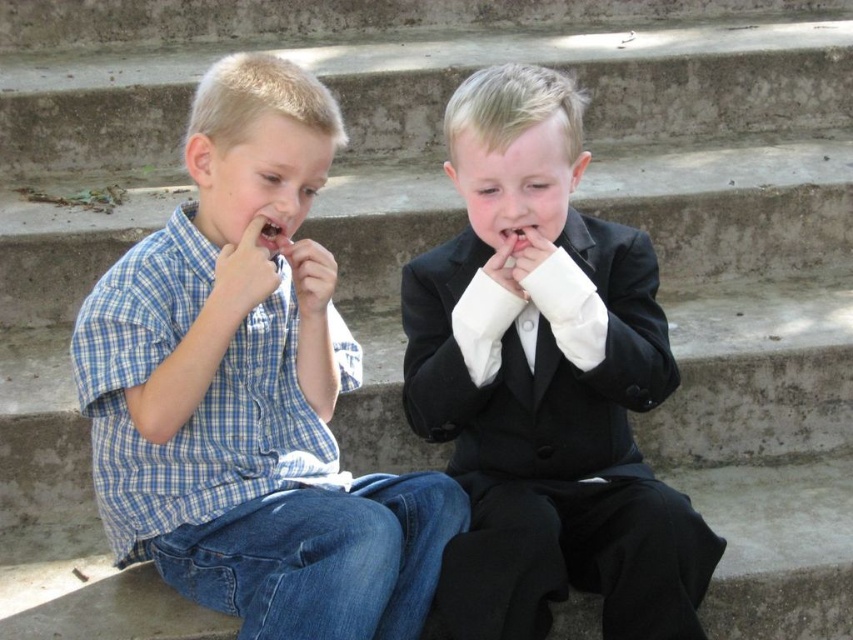
Which is more to the right, blue plaid shirt at left or pink flesh at center?

From the viewer's perspective, pink flesh at center appears more on the right side.

Can you confirm if blue plaid shirt at left is positioned below pink flesh at center?

Correct, blue plaid shirt at left is located below pink flesh at center.

Where is `blue plaid shirt at left`? The height and width of the screenshot is (640, 853). blue plaid shirt at left is located at coordinates (250, 390).

Which is more to the right, blue plaid shirt at left or smooth white teeth at center?

smooth white teeth at center

Does blue plaid shirt at left appear on the left side of smooth white teeth at center?

Correct, you'll find blue plaid shirt at left to the left of smooth white teeth at center.

Which is in front, point (109, 512) or point (273, 232)?

Point (273, 232) is in front.

Locate an element on the screen. The image size is (853, 640). blue plaid shirt at left is located at coordinates (250, 390).

Is point (598, 515) in front of point (258, 211)?

No, it is not.

Can you confirm if shiny black suit at center is taller than smooth white teeth at center?

Yes, shiny black suit at center is taller than smooth white teeth at center.

The height and width of the screenshot is (640, 853). What do you see at coordinates (544, 384) in the screenshot? I see `shiny black suit at center` at bounding box center [544, 384].

This screenshot has width=853, height=640. I want to click on shiny black suit at center, so (x=544, y=384).